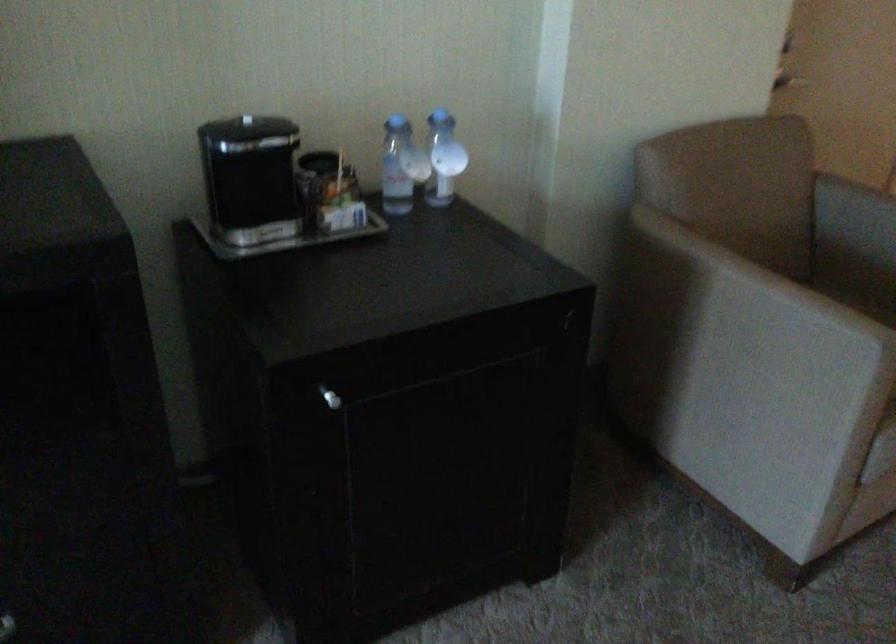
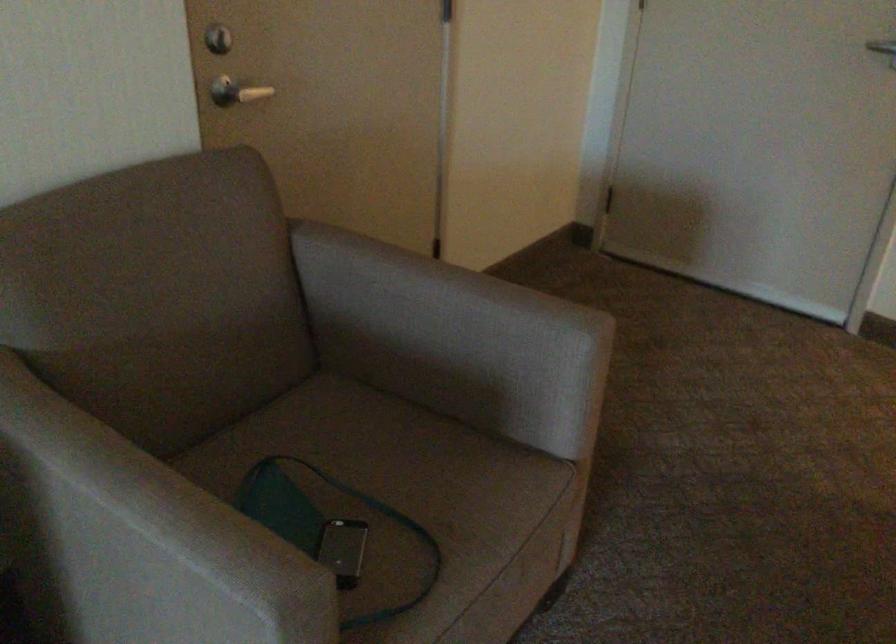
Locate, in the second image, the point that corresponds to (x=782, y=303) in the first image.

(150, 538)